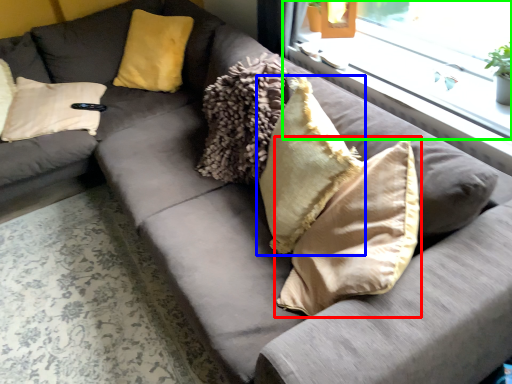
Question: Which object is positioned closest to pillow (highlighted by a red box)? Select from pillow (highlighted by a blue box) and window (highlighted by a green box).

Choices:
 (A) pillow
 (B) window

Answer: (A)